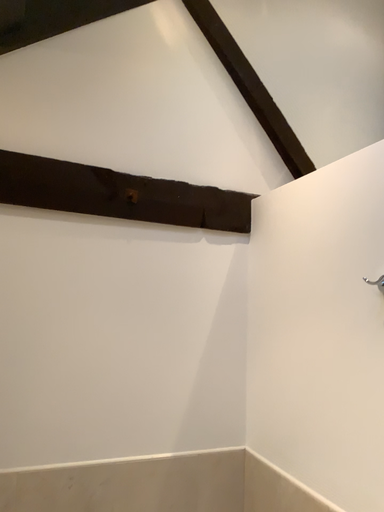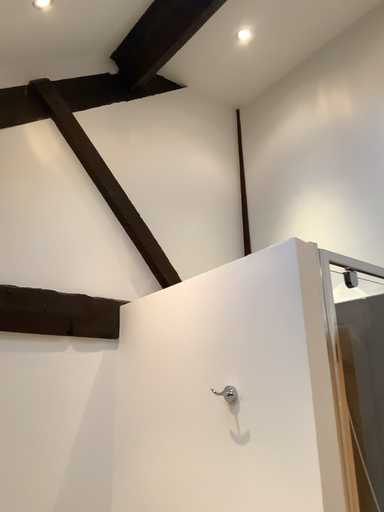
Question: How did the camera likely rotate when shooting the video?

Choices:
 (A) rotated right
 (B) rotated left

Answer: (A)